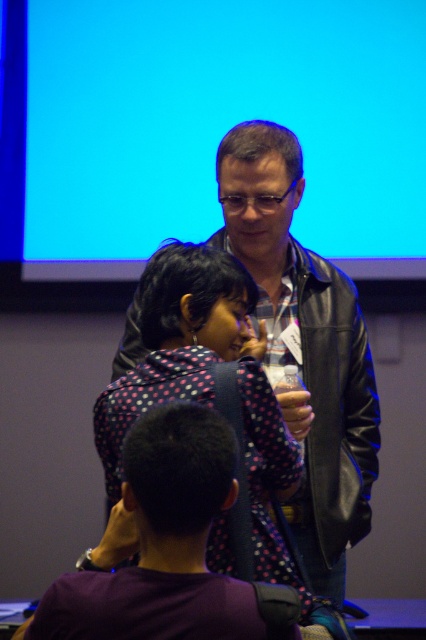
You are an event organizer who needs to arrange a photo shoot in this room. You want to ensure the polka dot fabric at center and the leather jacket at center are both visible in the photo. Based on their positions, which object should be moved forward to make both visible?

The polka dot fabric at center is currently behind the leather jacket at center. To make both visible, move the polka dot fabric at center forward so it is in front of the leather jacket at center.

You are organizing a photoshoot and need to ensure that the leather jacket at center and the polka dot fabric at center are positioned correctly according to the scene. Based on the description, which object is placed higher in the image?

The leather jacket at center is located above the polka dot fabric at center, so the leather jacket at center is placed higher in the image.

You are organizing a small event and need to place a 12 inch wide decorative item between the purple dotted shirt at lower center and the polka dot fabric at center. Is there enough space between them to fit the item?

The distance between the purple dotted shirt at lower center and the polka dot fabric at center is 10.83 inches. Since the decorative item is 12 inches wide, it will not fit in the available space.